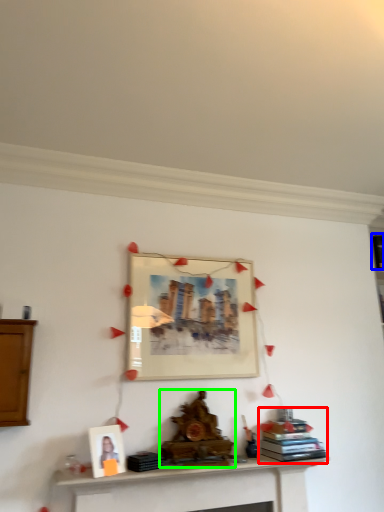
Question: Based on their relative distances, which object is nearer to book (highlighted by a red box)? Choose from book (highlighted by a blue box) and fireplace (highlighted by a green box).

Choices:
 (A) book
 (B) fireplace

Answer: (B)